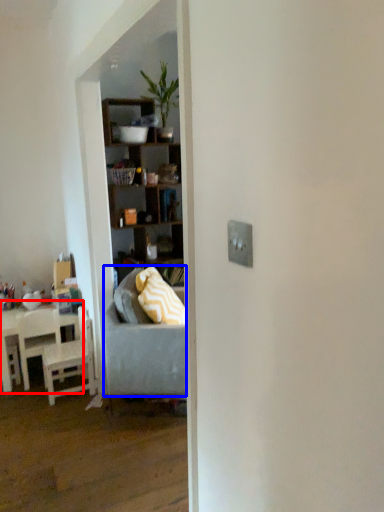
Question: Which object is further to the camera taking this photo, table (highlighted by a red box) or studio couch (highlighted by a blue box)?

Choices:
 (A) table
 (B) studio couch

Answer: (A)